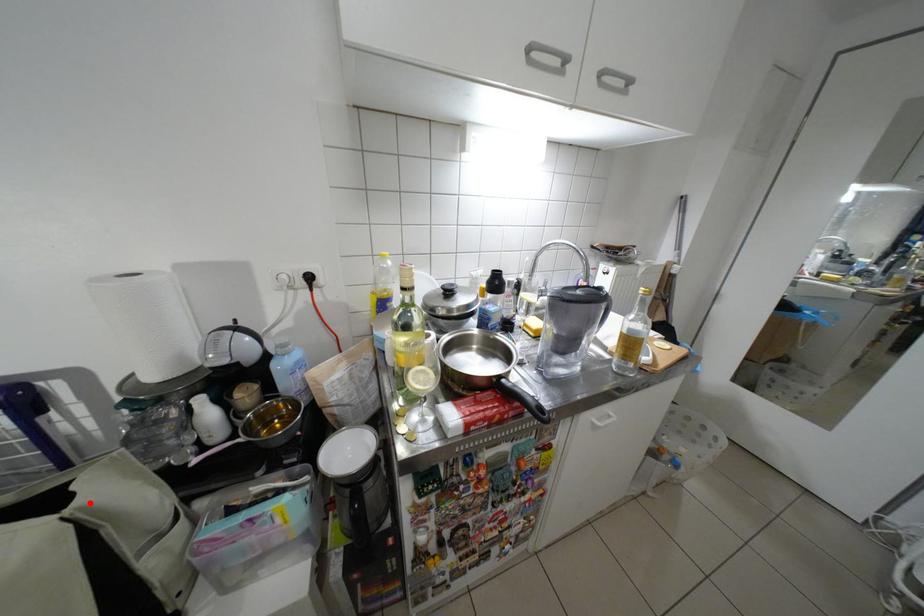
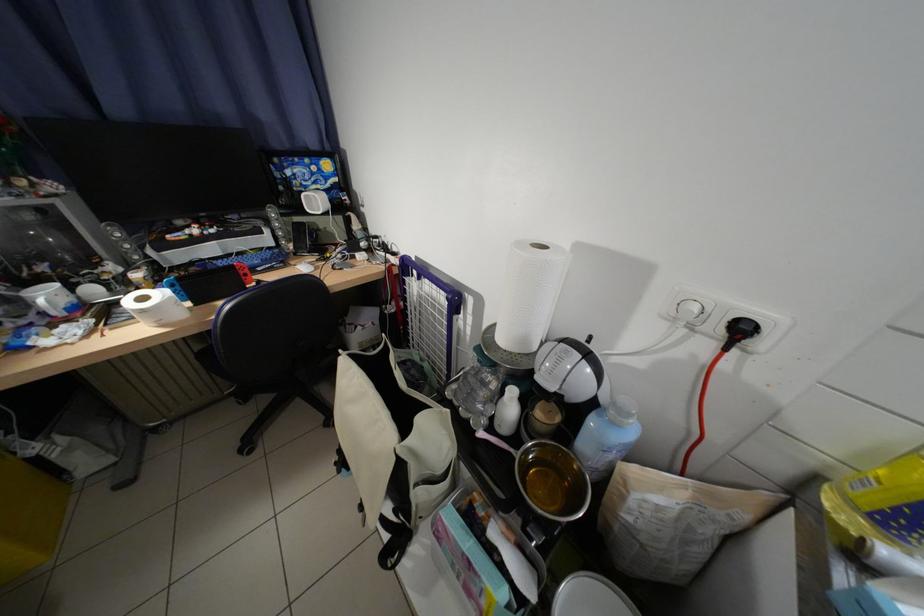
The point at the highlighted location is marked in the first image. Where is the corresponding point in the second image?

(419, 442)